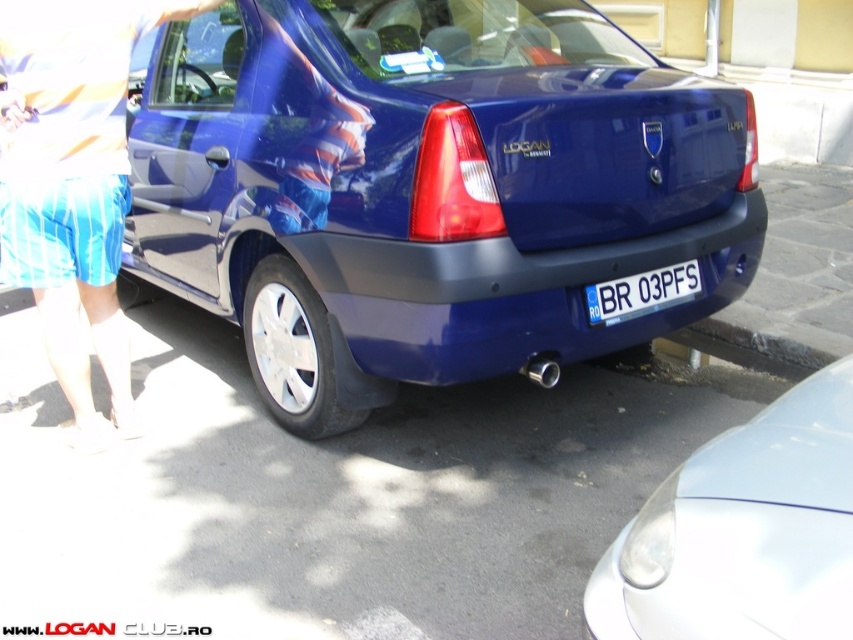
Can you confirm if glossy blue sedan at center is positioned to the left of blue striped shorts at lower left?

No, glossy blue sedan at center is not to the left of blue striped shorts at lower left.

Does glossy blue sedan at center have a greater height compared to blue striped shorts at lower left?

Indeed, glossy blue sedan at center has a greater height compared to blue striped shorts at lower left.

The height and width of the screenshot is (640, 853). What are the coordinates of `glossy blue sedan at center` in the screenshot? It's located at (428, 189).

Find the location of a particular element. Image resolution: width=853 pixels, height=640 pixels. glossy blue sedan at center is located at coordinates (428, 189).

Can you confirm if glossy blue sedan at center is positioned to the left of white glossy car at lower right?

Indeed, glossy blue sedan at center is positioned on the left side of white glossy car at lower right.

This screenshot has width=853, height=640. Find the location of `glossy blue sedan at center`. glossy blue sedan at center is located at coordinates (428, 189).

Is point (831, 576) farther from camera compared to point (49, 88)?

No, (831, 576) is closer to viewer.

Who is more forward, [843,497] or [84,284]?

Point [843,497] is more forward.

You are a GUI agent. You are given a task and a screenshot of the screen. Output one action in this format:
    pyautogui.click(x=<x>, y=<y>)
    Task: Click on the white glossy car at lower right
    This screenshot has width=853, height=640.
    Given the screenshot: What is the action you would take?
    pyautogui.click(x=743, y=531)